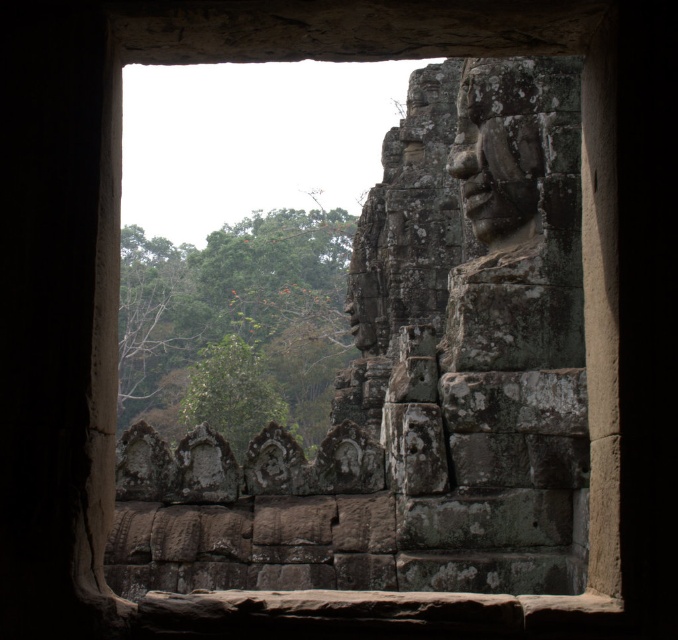
You are an architect examining an ancient temple structure. You notice a green leafy tree at left and a rough stone face at upper right. Based on their positions, which object is closer to the left edge of the stone window frame?

The green leafy tree at left is closer to the left edge of the stone window frame because it is positioned to the left of the rough stone face at upper right.

You are an architect examining an ancient structure. You notice the green leafy tree at left and the rough stone face at upper right through the window. Which object appears closer to you based on their positions in the scene?

The green leafy tree at left appears closer to you because it is further to the viewer than the rough stone face at upper right, meaning it is positioned nearer in the scene.

In the scene shown: You are an architect analyzing the proportions of elements in this ancient structure. Given the green leafy tree at left and the rough stone face at upper right, which object has a greater width?

The green leafy tree at left has a greater width than the rough stone face at upper right.